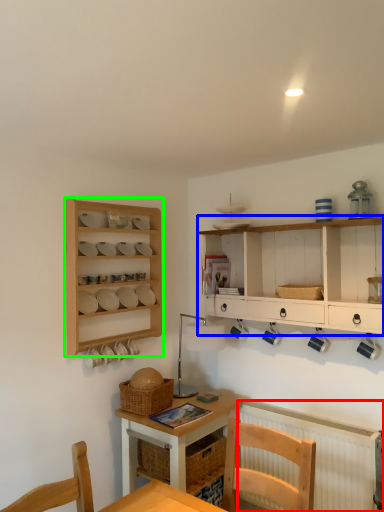
Question: Which is farther away from radiator (highlighted by a red box)? cabinetry (highlighted by a blue box) or shelf (highlighted by a green box)?

Choices:
 (A) cabinetry
 (B) shelf

Answer: (B)